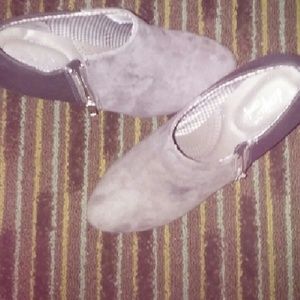
This screenshot has height=300, width=300. Find the location of `carpet`. carpet is located at coordinates (262, 260).